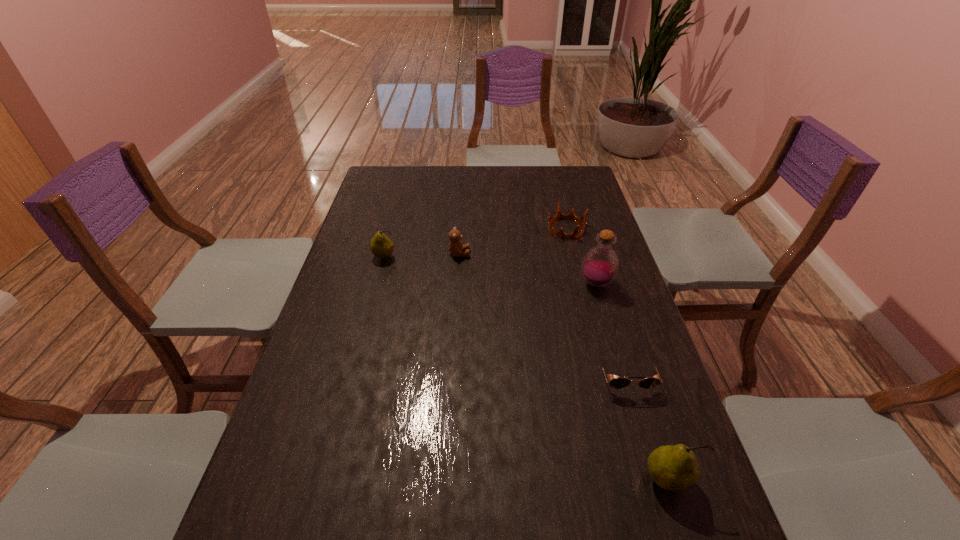
In order to click on free space located on the front of the leftmost object in this screenshot , I will do `click(377, 282)`.

Identify the location of vacant space located 0.240m on the left of the nearest object. (525, 480).

At what (x,y) coordinates should I click in order to perform the action: click on vacant space located 0.400m on the left of the crown. Please return your answer as a coordinate pair (x, y). Image resolution: width=960 pixels, height=540 pixels. Looking at the image, I should click on (433, 228).

Where is `vacant region located on the front lenses of the sunglasses`? Image resolution: width=960 pixels, height=540 pixels. vacant region located on the front lenses of the sunglasses is located at coordinates (653, 468).

Image resolution: width=960 pixels, height=540 pixels. What are the coordinates of `vacant area situated on the left of the bottle` in the screenshot? It's located at (526, 284).

This screenshot has width=960, height=540. In order to click on free space located 0.150m on the face of the third shortest object in this screenshot , I will do coord(516,254).

Where is `object present at the near edge`? The image size is (960, 540). object present at the near edge is located at coordinates (672, 468).

Where is `object positioned at the left edge`? object positioned at the left edge is located at coordinates (381, 246).

You are a GUI agent. You are given a task and a screenshot of the screen. Output one action in this format:
    pyautogui.click(x=<x>, y=<y>)
    Task: Click on the pear at the right edge
    
    Given the screenshot: What is the action you would take?
    pyautogui.click(x=672, y=468)

Locate an element on the screen. This screenshot has height=540, width=960. crown present at the right edge is located at coordinates pos(559,215).